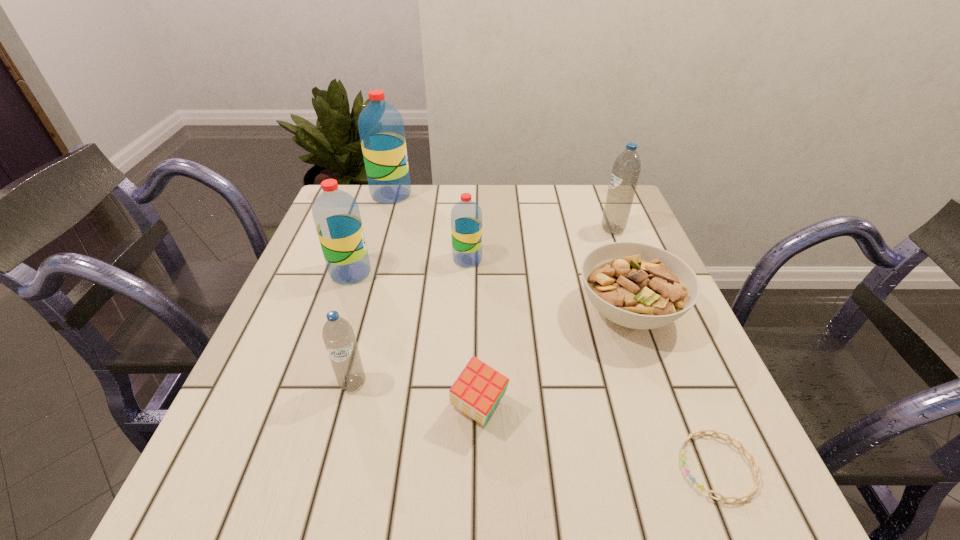
Image resolution: width=960 pixels, height=540 pixels. I want to click on vacant space located on the surface of the bracelet showing star-shaped elements, so click(573, 467).

Where is `vacant space located on the surface of the bracelet showing star-shaped elements`? The image size is (960, 540). vacant space located on the surface of the bracelet showing star-shaped elements is located at coordinates (470, 467).

At what (x,y) coordinates should I click in order to perform the action: click on vacant space located on the surface of the bracelet showing star-shaped elements. Please return your answer as a coordinate pair (x, y). Image resolution: width=960 pixels, height=540 pixels. Looking at the image, I should click on (509, 467).

Where is `object located at the near edge`? The image size is (960, 540). object located at the near edge is located at coordinates click(757, 480).

This screenshot has width=960, height=540. Identify the location of water bottle at the right edge. (626, 169).

The image size is (960, 540). Find the location of `stew that is at the right edge`. stew that is at the right edge is located at coordinates (639, 286).

The height and width of the screenshot is (540, 960). I want to click on bracelet that is at the right edge, so click(757, 480).

Identify the location of object present at the far left corner. (381, 128).

Image resolution: width=960 pixels, height=540 pixels. I want to click on object that is at the far right corner, so click(x=626, y=169).

Identify the location of object that is positioned at the near right corner. This screenshot has width=960, height=540. (757, 480).